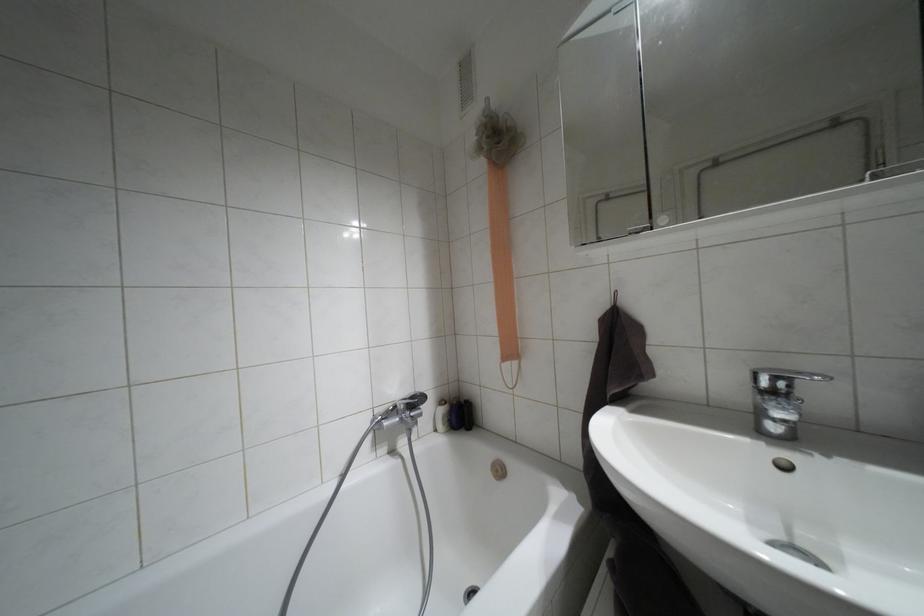
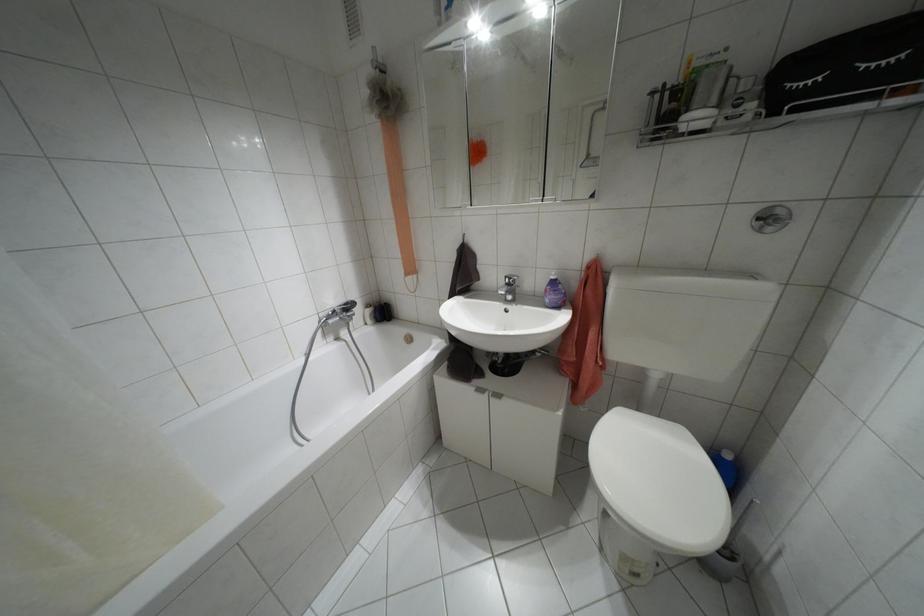
In the second image, find the point that corresponds to the point at 441,400 in the first image.

(367, 305)